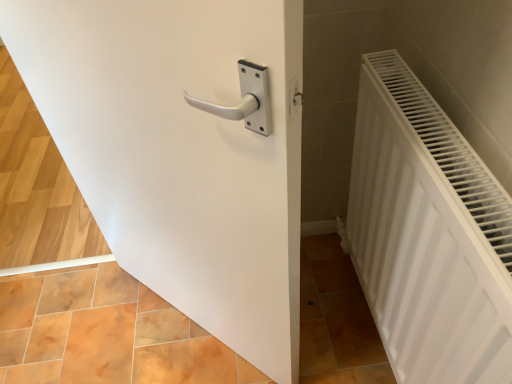
Describe the element at coordinates (181, 151) in the screenshot. I see `white matte door handle at center` at that location.

What is the approximate height of white matte door handle at center?

It is 1.12 meters.

I want to click on white matte door handle at center, so click(x=181, y=151).

Locate an element on the screen. This screenshot has width=512, height=384. white matte door handle at center is located at coordinates (181, 151).